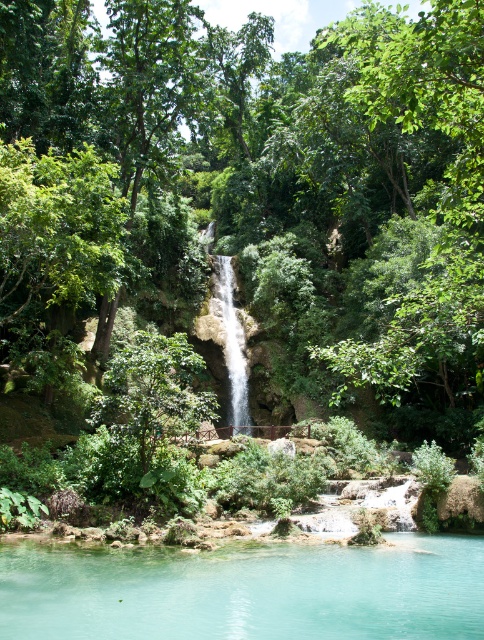
Question: Where is turquoise clear water at center located in relation to translucent glass waterfall at center in the image?

Choices:
 (A) left
 (B) right

Answer: (B)

Question: Which point is farther to the camera?

Choices:
 (A) (30, 630)
 (B) (237, 376)

Answer: (B)

Question: Is turquoise clear water at center positioned in front of translucent glass waterfall at center?

Choices:
 (A) no
 (B) yes

Answer: (B)

Question: Can you confirm if turquoise clear water at center is smaller than translucent glass waterfall at center?

Choices:
 (A) yes
 (B) no

Answer: (A)

Question: Which point is farther to the camera?

Choices:
 (A) translucent glass waterfall at center
 (B) turquoise clear water at center

Answer: (A)

Question: Which object appears closest to the camera in this image?

Choices:
 (A) turquoise clear water at center
 (B) translucent glass waterfall at center

Answer: (A)